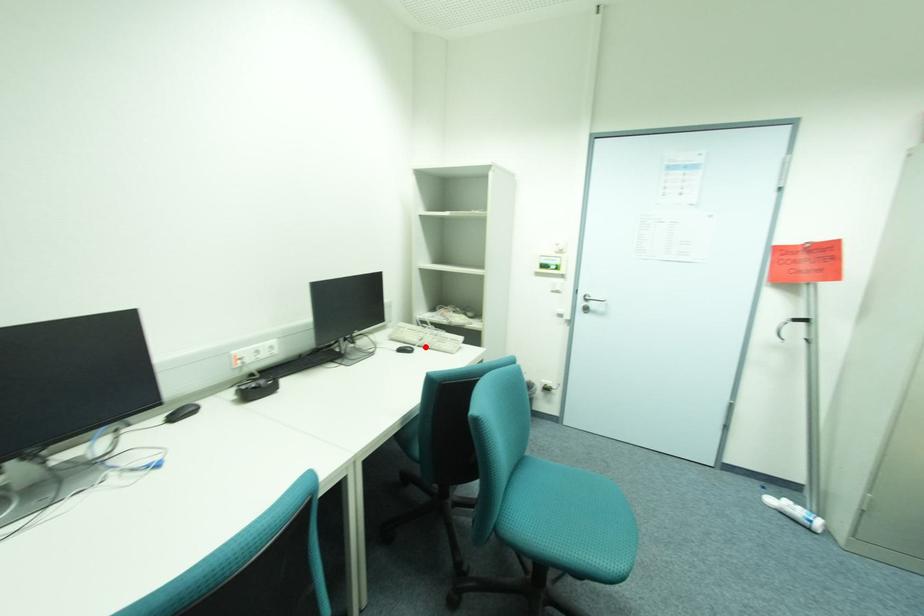
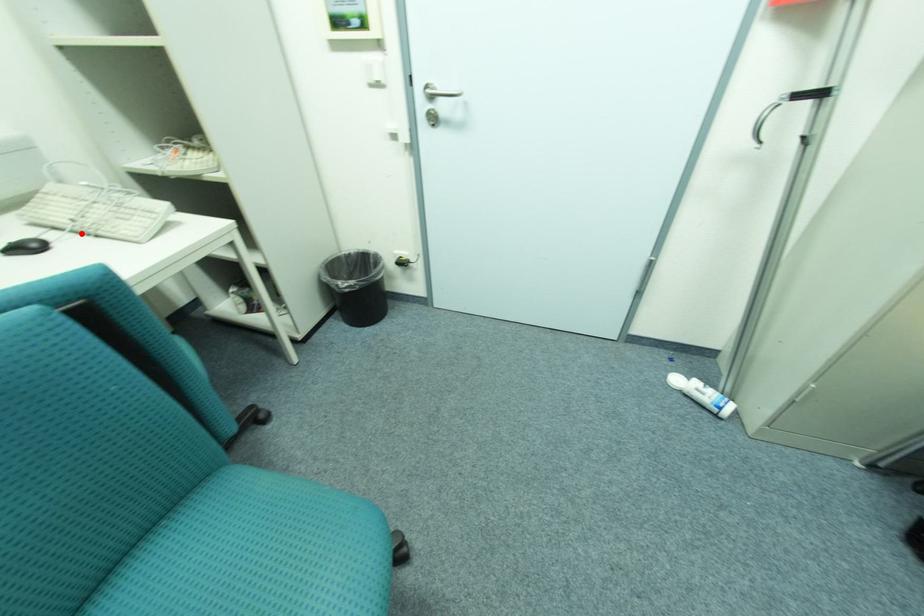
I am providing you with two images of the same scene from different viewpoints. A red point is marked on the first image and another point is marked on the second image. Do the highlighted points in image1 and image2 indicate the same real-world spot?

Yes